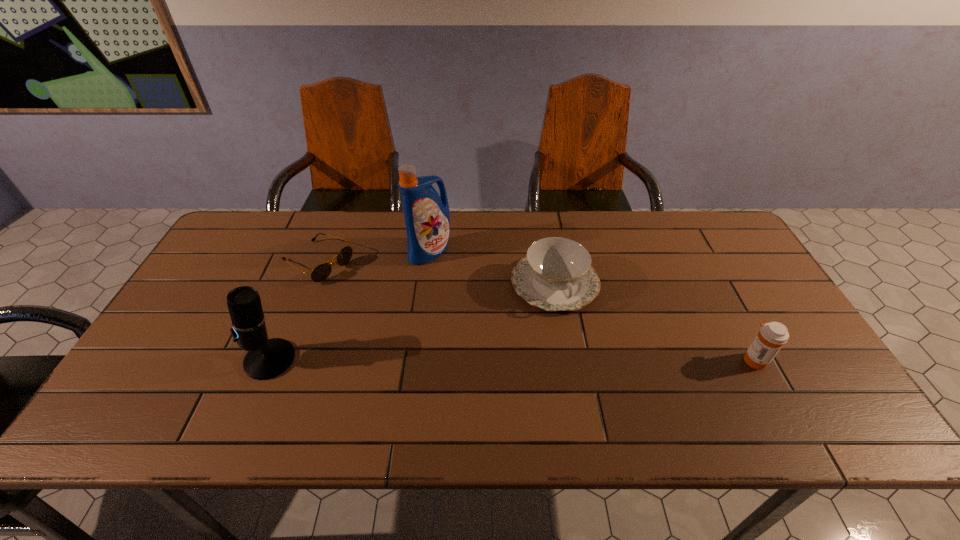
I want to click on sunglasses situated at the far edge, so click(x=321, y=272).

The image size is (960, 540). Find the location of `chinaware that is at the far edge`. chinaware that is at the far edge is located at coordinates (556, 274).

You are a GUI agent. You are given a task and a screenshot of the screen. Output one action in this format:
    pyautogui.click(x=<x>, y=<y>)
    Task: Click on the microphone that is positioned at the near edge
    The width and height of the screenshot is (960, 540).
    Given the screenshot: What is the action you would take?
    pyautogui.click(x=267, y=358)

This screenshot has width=960, height=540. What are the coordinates of `medicine that is at the near edge` in the screenshot? It's located at (772, 336).

The width and height of the screenshot is (960, 540). I want to click on object positioned at the right edge, so coord(772,336).

You are a GUI agent. You are given a task and a screenshot of the screen. Output one action in this format:
    pyautogui.click(x=<x>, y=<y>)
    Task: Click on the object at the near right corner
    The image size is (960, 540).
    Given the screenshot: What is the action you would take?
    [x=772, y=336]

Find the location of a particular element. Image resolution: width=960 pixels, height=540 pixels. free space at the far edge is located at coordinates (484, 235).

In the image, there is a desktop. Identify the location of vacant area at the near edge. click(436, 389).

Find the location of a particular element. The image size is (960, 540). vacant space at the left edge is located at coordinates (177, 354).

Identify the location of free space at the right edge of the desktop. (730, 299).